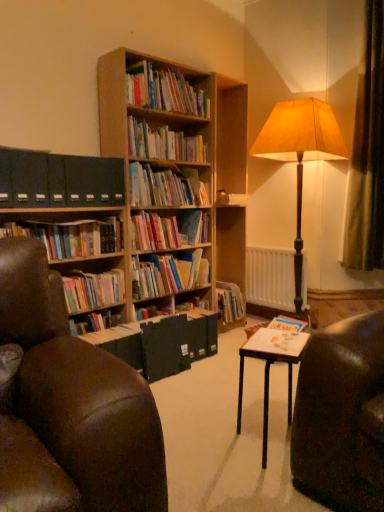
Question: From the image's perspective, is white matte radiator at center located beneath hardcover books at center, arranged as the first book when ordered from the bottom?

Choices:
 (A) no
 (B) yes

Answer: (A)

Question: Is the surface of white matte radiator at center in direct contact with hardcover books at center, arranged as the first book when ordered from the bottom?

Choices:
 (A) yes
 (B) no

Answer: (B)

Question: Is hardcover books at center, positioned as the seventh book in top-to-bottom order, at the back of white matte radiator at center?

Choices:
 (A) yes
 (B) no

Answer: (B)

Question: Can you confirm if white matte radiator at center is positioned to the right of hardcover books at center, positioned as the seventh book in top-to-bottom order?

Choices:
 (A) no
 (B) yes

Answer: (B)

Question: Does white matte radiator at center contain hardcover books at center, arranged as the first book when ordered from the bottom?

Choices:
 (A) no
 (B) yes

Answer: (A)

Question: Visually, is hardcover books at center, the fourth book when ordered from top to bottom, positioned to the left or to the right of hardcover books at center, which is the 5th book in bottom-to-top order?

Choices:
 (A) left
 (B) right

Answer: (A)

Question: Is hardcover books at center, the fourth book when ordered from top to bottom, wider or thinner than hardcover books at center, which is the third book in top-to-bottom order?

Choices:
 (A) thin
 (B) wide

Answer: (A)

Question: Is point (173, 245) positioned closer to the camera than point (173, 179)?

Choices:
 (A) farther
 (B) closer

Answer: (A)

Question: Is hardcover books at center, placed as the fourth book when sorted from bottom to top, bigger or smaller than hardcover books at center, which is the third book in top-to-bottom order?

Choices:
 (A) small
 (B) big

Answer: (A)

Question: Looking at the image, does wooden bookshelf at upper center, placed as the seventh book when sorted from bottom to top, seem bigger or smaller compared to brown velvet curtain at right?

Choices:
 (A) small
 (B) big

Answer: (A)

Question: Based on their positions, is wooden bookshelf at upper center, the first book from the top, located to the left or right of brown velvet curtain at right?

Choices:
 (A) right
 (B) left

Answer: (B)

Question: From the image's perspective, is wooden bookshelf at upper center, the first book from the top, above or below brown velvet curtain at right?

Choices:
 (A) above
 (B) below

Answer: (A)

Question: Is wooden bookshelf at upper center, placed as the seventh book when sorted from bottom to top, in front of or behind brown velvet curtain at right in the image?

Choices:
 (A) behind
 (B) front

Answer: (B)

Question: In terms of size, does black matte file folders at left appear bigger or smaller than hardcover books at center, the fourth book when ordered from top to bottom?

Choices:
 (A) small
 (B) big

Answer: (A)

Question: Is point (11, 169) closer or farther from the camera than point (173, 230)?

Choices:
 (A) farther
 (B) closer

Answer: (B)